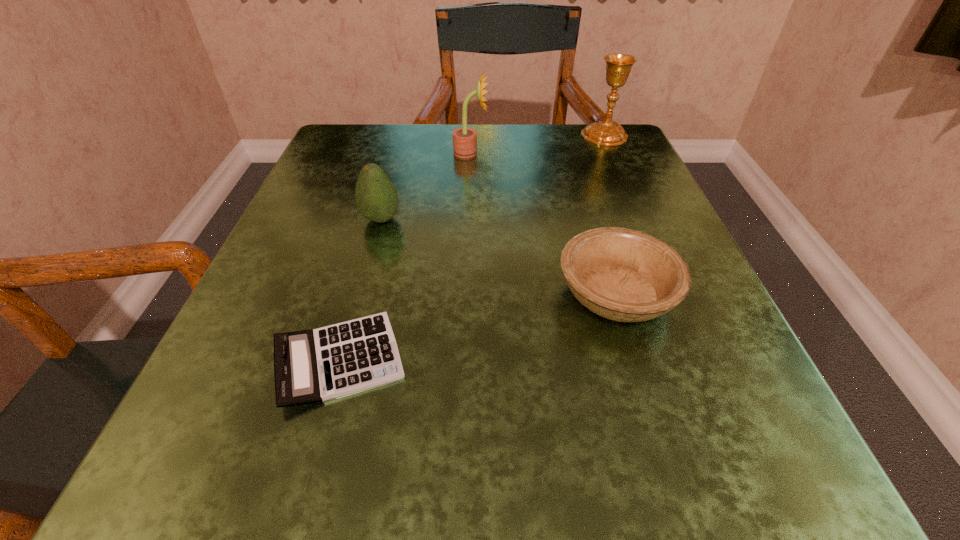
You are a GUI agent. You are given a task and a screenshot of the screen. Output one action in this format:
    pyautogui.click(x=<x>, y=<y>)
    Task: Click on the free space that is in between the second shortest object and the third farthest object
    This screenshot has height=540, width=960.
    Given the screenshot: What is the action you would take?
    pyautogui.click(x=498, y=256)

Find the location of a particular element. The width and height of the screenshot is (960, 540). vacant space that is in between the chalice and the fourth tallest object is located at coordinates (611, 214).

The width and height of the screenshot is (960, 540). I want to click on free area in between the calculator and the third farthest object, so click(x=360, y=289).

Locate an element on the screen. The image size is (960, 540). free space between the third tallest object and the second shortest object is located at coordinates (498, 256).

Identify the location of free space between the chalice and the second shortest object. (611, 214).

Find the location of `free point between the avocado and the chalice`. free point between the avocado and the chalice is located at coordinates (492, 177).

Where is `object identified as the closest to the chalice`? This screenshot has width=960, height=540. object identified as the closest to the chalice is located at coordinates (464, 139).

Find the location of a particular element. the second closest object to the avocado is located at coordinates (310, 366).

Locate an element on the screen. This screenshot has height=540, width=960. vacant space that satisfies the following two spatial constraints: 1. on the front side of the third farthest object; 2. on the right side of the bowl is located at coordinates (361, 294).

You are a GUI agent. You are given a task and a screenshot of the screen. Output one action in this format:
    pyautogui.click(x=<x>, y=<y>)
    Task: Click on the blank space that satisfies the following two spatial constraints: 1. on the back side of the chalice; 2. on the left side of the avocado
    
    Given the screenshot: What is the action you would take?
    pyautogui.click(x=403, y=135)